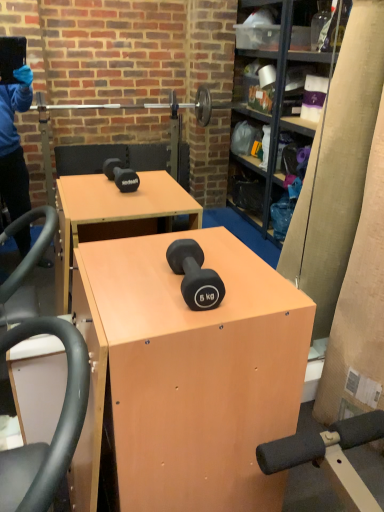
Question: Considering the relative positions of matte black dumbbell at center and light brown wood desk at center in the image provided, is matte black dumbbell at center behind light brown wood desk at center?

Choices:
 (A) no
 (B) yes

Answer: (B)

Question: Is matte black dumbbell at center aimed at light brown wood desk at center?

Choices:
 (A) yes
 (B) no

Answer: (B)

Question: Is matte black dumbbell at center in front of light brown wood desk at center?

Choices:
 (A) no
 (B) yes

Answer: (A)

Question: Does matte black dumbbell at center have a smaller size compared to light brown wood desk at center?

Choices:
 (A) no
 (B) yes

Answer: (B)

Question: From the image's perspective, is matte black dumbbell at center located beneath light brown wood desk at center?

Choices:
 (A) no
 (B) yes

Answer: (A)

Question: Does matte black dumbbell at center appear on the right side of light brown wood desk at center?

Choices:
 (A) yes
 (B) no

Answer: (A)

Question: From the image's perspective, is light brown wood desk at center located above matte black dumbbell at center?

Choices:
 (A) yes
 (B) no

Answer: (B)

Question: Does light brown wood desk at center lie behind matte black dumbbell at center?

Choices:
 (A) no
 (B) yes

Answer: (A)

Question: From a real-world perspective, is light brown wood desk at center physically above matte black dumbbell at center?

Choices:
 (A) no
 (B) yes

Answer: (A)

Question: Does light brown wood desk at center have a larger size compared to matte black dumbbell at center?

Choices:
 (A) yes
 (B) no

Answer: (A)

Question: Is light brown wood desk at center in front of matte black dumbbell at center?

Choices:
 (A) no
 (B) yes

Answer: (B)

Question: Is light brown wood desk at center at the left side of matte black dumbbell at center?

Choices:
 (A) yes
 (B) no

Answer: (A)

Question: From a real-world perspective, relative to light brown wood desk at center, is matte black dumbbell at center vertically above or below?

Choices:
 (A) below
 (B) above

Answer: (B)